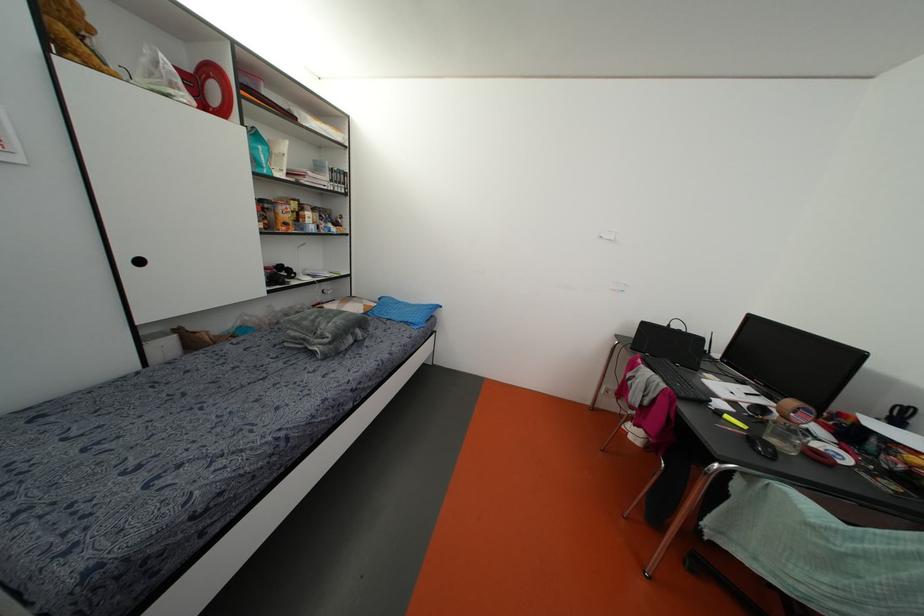
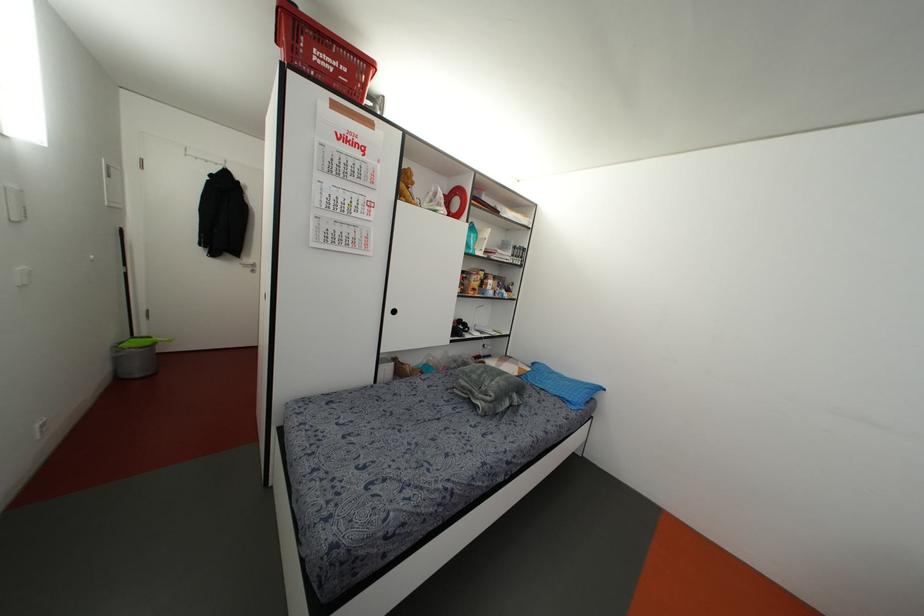
The point at (411, 321) is marked in the first image. Where is the corresponding point in the second image?

(569, 399)